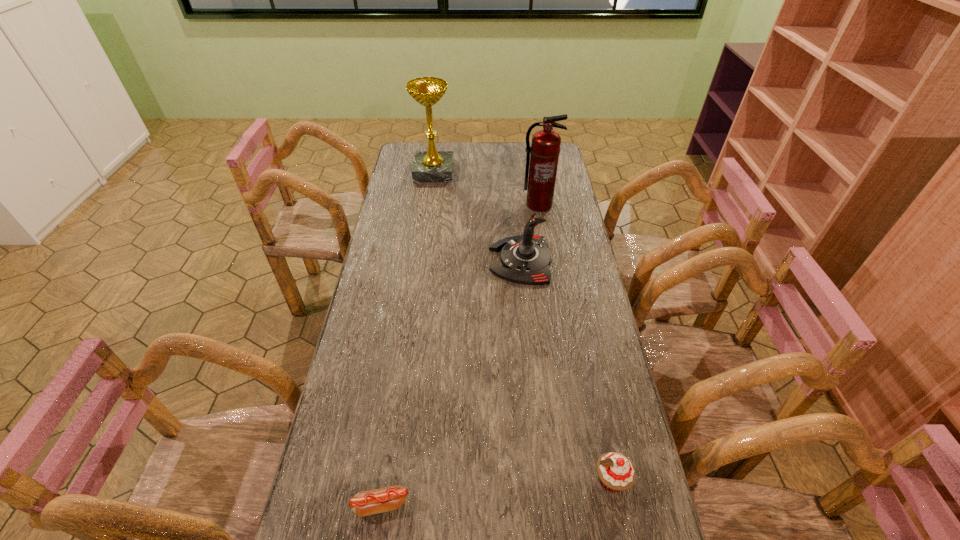
At what (x,y) coordinates should I click in order to perform the action: click on the farthest object. Please return your answer as a coordinate pair (x, y). Image resolution: width=960 pixels, height=540 pixels. Looking at the image, I should click on (429, 166).

Find the location of a particular element. This screenshot has height=540, width=960. fire extinguisher is located at coordinates (545, 147).

Find the location of a particular element. This screenshot has height=540, width=960. the third tallest object is located at coordinates (525, 259).

Where is `joystick`? The height and width of the screenshot is (540, 960). joystick is located at coordinates (525, 259).

This screenshot has height=540, width=960. Identify the location of cupcake. (616, 472).

Find the location of a particular element. Image resolution: width=960 pixels, height=540 pixels. the shortest object is located at coordinates (364, 503).

Locate an element on the screen. vacant area located on the front-facing side of the award is located at coordinates (482, 172).

I want to click on vacant space located 0.240m on the side of the fire extinguisher with the handle and hose, so click(546, 252).

What are the coordinates of `free location located on the handle side of the joystick` in the screenshot? It's located at (434, 260).

The width and height of the screenshot is (960, 540). Identify the location of free space located 0.110m on the handle side of the joystick. (459, 260).